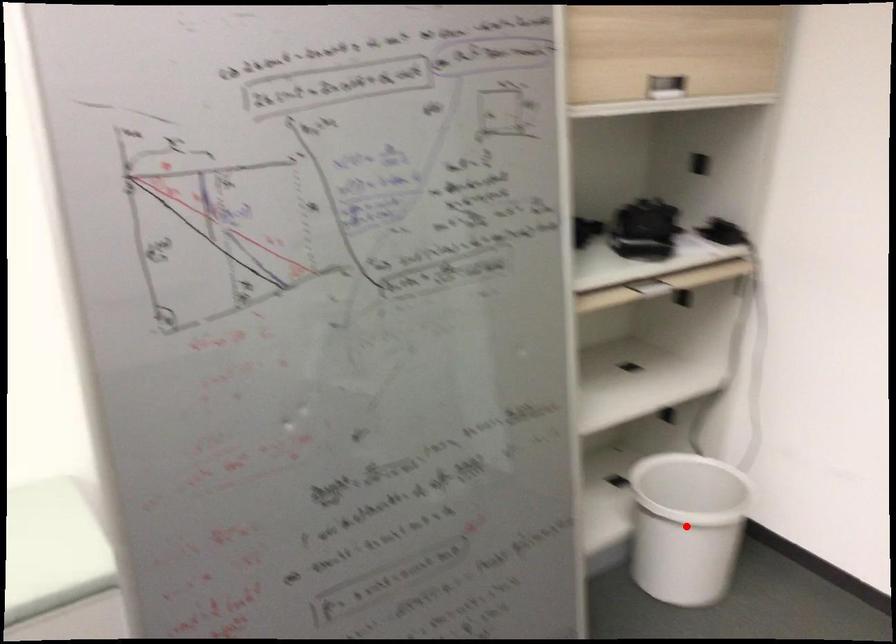
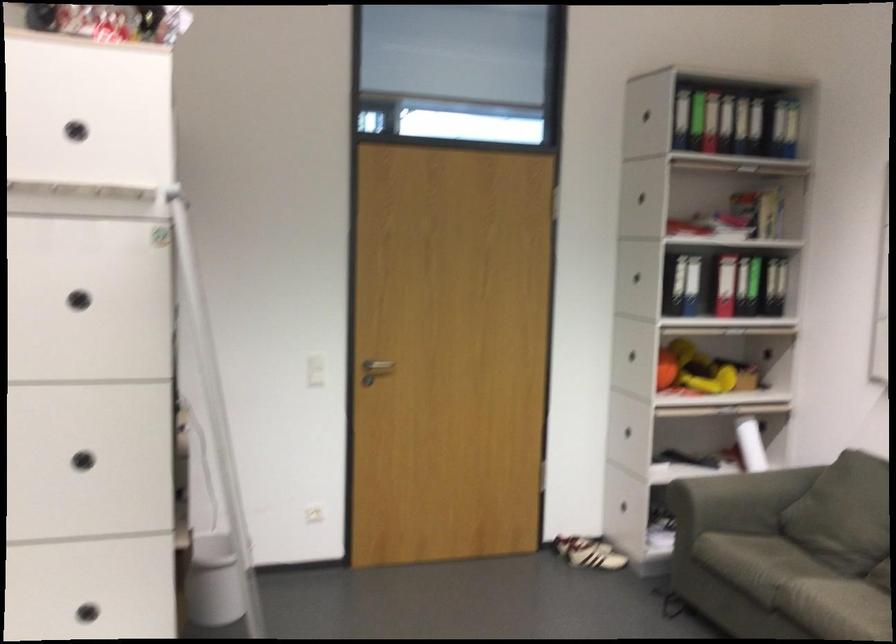
Question: I am providing you with two images of the same scene from different viewpoints. A red point is marked on the first image. Is the red point's position out of view in image 2?

Choices:
 (A) Yes
 (B) No

Answer: (A)